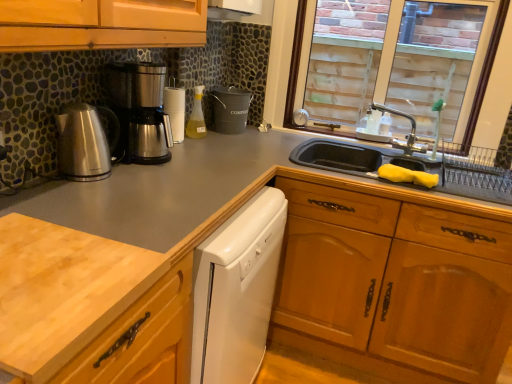
Question: Is brushed metal kettle at left, positioned as the 1th kitchen appliance in front-to-back order, facing towards clear glass window at upper right?

Choices:
 (A) no
 (B) yes

Answer: (A)

Question: Is brushed metal kettle at left, positioned as the 1th kitchen appliance in front-to-back order, to the right of clear glass window at upper right from the viewer's perspective?

Choices:
 (A) no
 (B) yes

Answer: (A)

Question: From a real-world perspective, is brushed metal kettle at left, positioned as the 1th kitchen appliance in front-to-back order, positioned under clear glass window at upper right based on gravity?

Choices:
 (A) no
 (B) yes

Answer: (B)

Question: Is brushed metal kettle at left, positioned as the 1th kitchen appliance in front-to-back order, at the left side of clear glass window at upper right?

Choices:
 (A) yes
 (B) no

Answer: (A)

Question: Would you say brushed metal kettle at left, marked as the second kitchen appliance in a back-to-front arrangement, is outside clear glass window at upper right?

Choices:
 (A) yes
 (B) no

Answer: (A)

Question: From a real-world perspective, relative to translucent plastic bottle at center, is light wood cutting board at lower left vertically above or below?

Choices:
 (A) above
 (B) below

Answer: (B)

Question: In the image, is light wood cutting board at lower left on the left side or the right side of translucent plastic bottle at center?

Choices:
 (A) right
 (B) left

Answer: (B)

Question: Which is correct: light wood cutting board at lower left is inside translucent plastic bottle at center, or outside of it?

Choices:
 (A) outside
 (B) inside

Answer: (A)

Question: Does point pyautogui.click(x=136, y=364) appear closer or farther from the camera than point pyautogui.click(x=197, y=132)?

Choices:
 (A) farther
 (B) closer

Answer: (B)

Question: Is light wood cutting board at lower left spatially inside brushed metal kettle at left, marked as the second kitchen appliance in a back-to-front arrangement, or outside of it?

Choices:
 (A) inside
 (B) outside

Answer: (B)

Question: In the image, is light wood cutting board at lower left on the left side or the right side of brushed metal kettle at left, positioned as the 1th kitchen appliance in front-to-back order?

Choices:
 (A) left
 (B) right

Answer: (B)

Question: From the image's perspective, is light wood cutting board at lower left located above or below brushed metal kettle at left, marked as the second kitchen appliance in a back-to-front arrangement?

Choices:
 (A) below
 (B) above

Answer: (A)

Question: Relative to brushed metal kettle at left, positioned as the 1th kitchen appliance in front-to-back order, is light wood cutting board at lower left in front or behind?

Choices:
 (A) front
 (B) behind

Answer: (A)

Question: Is point (414, 135) closer or farther from the camera than point (93, 172)?

Choices:
 (A) farther
 (B) closer

Answer: (A)

Question: Choose the correct answer: Is silver metallic faucet at upper right inside brushed metal kettle at left, positioned as the 1th kitchen appliance in front-to-back order, or outside it?

Choices:
 (A) outside
 (B) inside

Answer: (A)